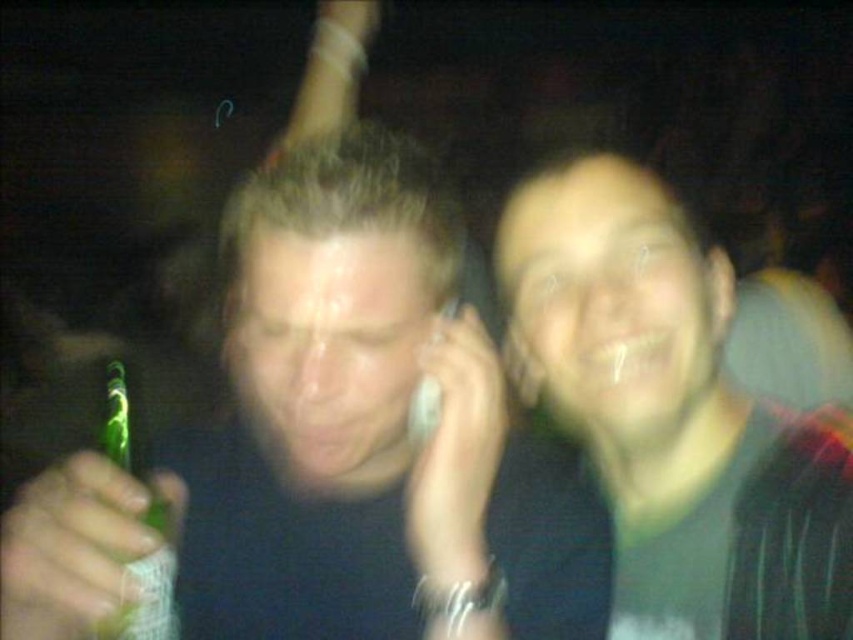
Which is behind, point (653, 204) or point (120, 611)?

The point (653, 204) is behind.

Does green matte beer can at right appear on the left side of green glass bottle at left?

Incorrect, green matte beer can at right is not on the left side of green glass bottle at left.

Measure the distance between green matte beer can at right and camera.

A distance of 24.24 inches exists between green matte beer can at right and camera.

You are a GUI agent. You are given a task and a screenshot of the screen. Output one action in this format:
    pyautogui.click(x=<x>, y=<y>)
    Task: Click on the green matte beer can at right
    
    Given the screenshot: What is the action you would take?
    pyautogui.click(x=670, y=410)

Is point (483, 564) positioned after point (119, 460)?

Yes.

Does green matte beer bottle at left have a lesser width compared to green glass bottle at left?

Incorrect, green matte beer bottle at left's width is not less than green glass bottle at left's.

You are a GUI agent. You are given a task and a screenshot of the screen. Output one action in this format:
    pyautogui.click(x=<x>, y=<y>)
    Task: Click on the green matte beer bottle at left
    The width and height of the screenshot is (853, 640).
    Given the screenshot: What is the action you would take?
    pyautogui.click(x=368, y=428)

Identify the location of green matte beer bottle at left. The image size is (853, 640). (368, 428).

Is the position of green matte beer bottle at left more distant than that of green matte beer can at right?

No.

Is green matte beer bottle at left to the right of green matte beer can at right from the viewer's perspective?

In fact, green matte beer bottle at left is to the left of green matte beer can at right.

Between point (421, 224) and point (746, 579), which one is positioned behind?

The point (746, 579) is behind.

Find the location of a particular element. This screenshot has height=640, width=853. green matte beer bottle at left is located at coordinates (368, 428).